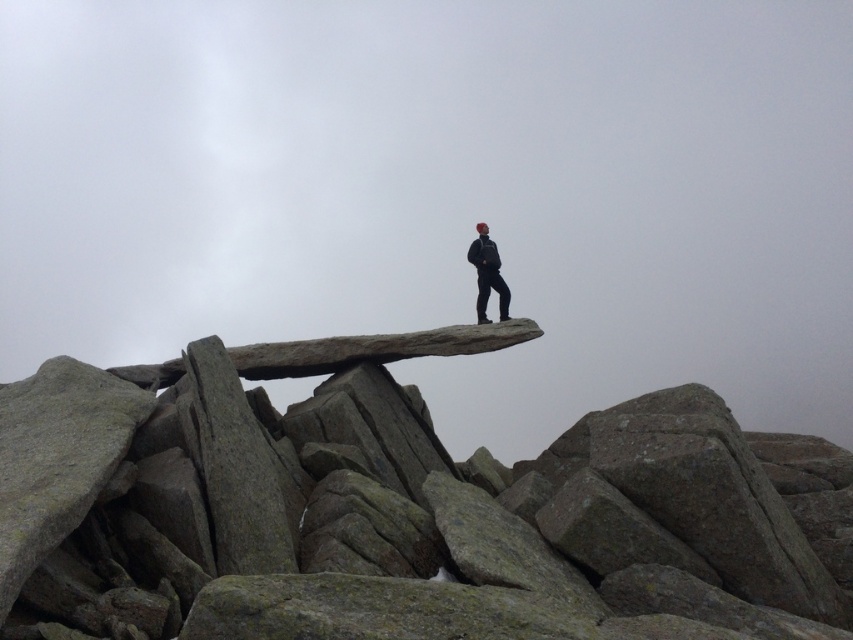
Which is more to the left, gray granite rock at center or dark gray fabric jacket at center?

gray granite rock at center

Is point (486, 552) positioned behind point (503, 301)?

No.

Where is `gray granite rock at center`? gray granite rock at center is located at coordinates (399, 509).